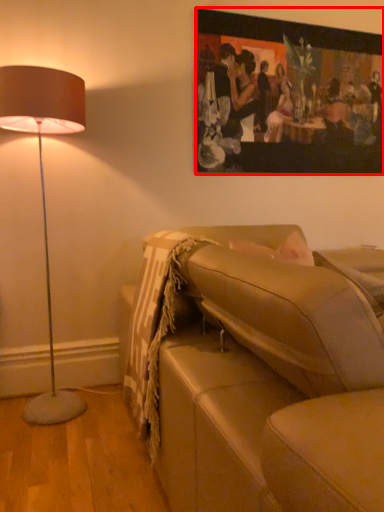
Question: From the image, what is the correct spatial relationship of picture frame (annotated by the red box) in relation to studio couch?

Choices:
 (A) left
 (B) right

Answer: (B)